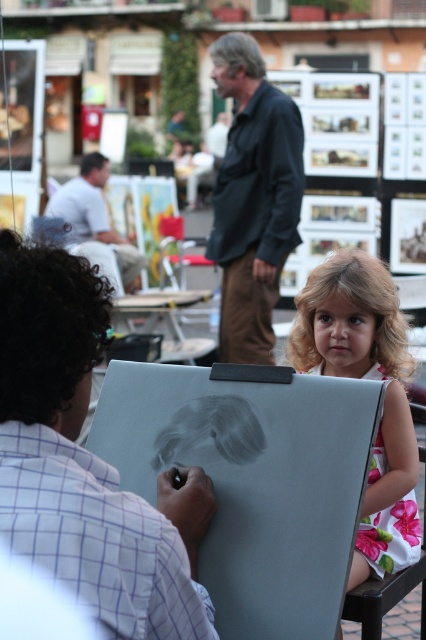
You are a photographer at the art fair and want to capture a photo of the floral cotton dress at right and the floral fabric chair at lower right. Since you want to highlight the dress, which object should you place closer to the camera?

The floral cotton dress at right has a greater height compared to the floral fabric chair at lower right. To highlight the dress, you should place the floral cotton dress at right closer to the camera so its larger size is emphasized in the photo.

You are standing at the origin point in the image. You want to walk to the point labeled point (288, 358). However, there is an obstacle at point (345, 616). Will you encounter the obstacle before reaching your destination?

Since point (288, 358) is behind point (345, 616), you will encounter the obstacle at point (345, 616) before reaching your destination.

You are a photographer at the art fair and want to take a photo of the matte white dress at lower right and the floral cotton dress at right. Which dress is positioned closer to the camera?

The matte white dress at lower right is closer to the viewer than the floral cotton dress at right, so the matte white dress at lower right is closer to the camera.